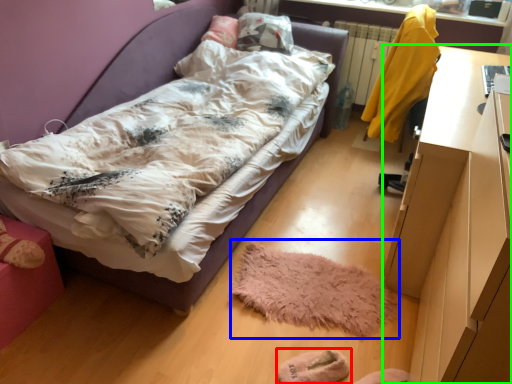
Question: Which object is the closest to the footwear (highlighted by a red box)? Choose among these: mat (highlighted by a blue box) or desk (highlighted by a green box).

Choices:
 (A) mat
 (B) desk

Answer: (A)